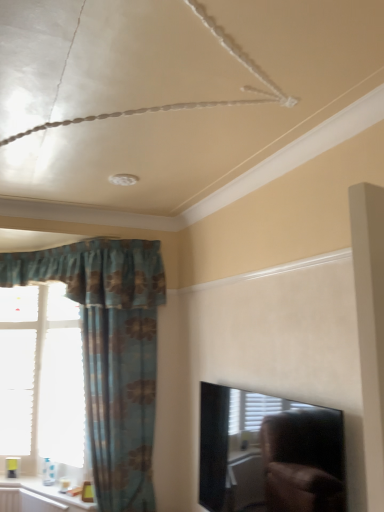
Question: Is white glossy window sill at lower left wider than blue floral fabric curtain at left?

Choices:
 (A) yes
 (B) no

Answer: (A)

Question: Does white glossy window sill at lower left have a lesser width compared to blue floral fabric curtain at left?

Choices:
 (A) no
 (B) yes

Answer: (A)

Question: Is there a large distance between white glossy window sill at lower left and blue floral fabric curtain at left?

Choices:
 (A) yes
 (B) no

Answer: (B)

Question: Would you say white glossy window sill at lower left contains blue floral fabric curtain at left?

Choices:
 (A) no
 (B) yes

Answer: (A)

Question: Does white glossy window sill at lower left appear on the left side of blue floral fabric curtain at left?

Choices:
 (A) no
 (B) yes

Answer: (B)

Question: Would you say black glossy tv at upper right is to the left or to the right of blue floral fabric curtain at left in the picture?

Choices:
 (A) left
 (B) right

Answer: (B)

Question: In terms of height, does black glossy tv at upper right look taller or shorter compared to blue floral fabric curtain at left?

Choices:
 (A) tall
 (B) short

Answer: (B)

Question: Is black glossy tv at upper right bigger or smaller than blue floral fabric curtain at left?

Choices:
 (A) small
 (B) big

Answer: (A)

Question: Do you think black glossy tv at upper right is within blue floral fabric curtain at left, or outside of it?

Choices:
 (A) inside
 (B) outside

Answer: (B)

Question: From a real-world perspective, is blue floral fabric curtain at left above or below white paper at left?

Choices:
 (A) above
 (B) below

Answer: (A)

Question: Is blue floral fabric curtain at left inside or outside of white paper at left?

Choices:
 (A) outside
 (B) inside

Answer: (A)

Question: From the image's perspective, relative to white paper at left, is blue floral fabric curtain at left above or below?

Choices:
 (A) above
 (B) below

Answer: (A)

Question: Is blue floral fabric curtain at left wider or thinner than white paper at left?

Choices:
 (A) wide
 (B) thin

Answer: (A)

Question: Is point (26, 504) positioned closer to the camera than point (243, 463)?

Choices:
 (A) farther
 (B) closer

Answer: (A)

Question: In terms of size, does white glossy window sill at lower left appear bigger or smaller than black glossy tv at upper right?

Choices:
 (A) small
 (B) big

Answer: (A)